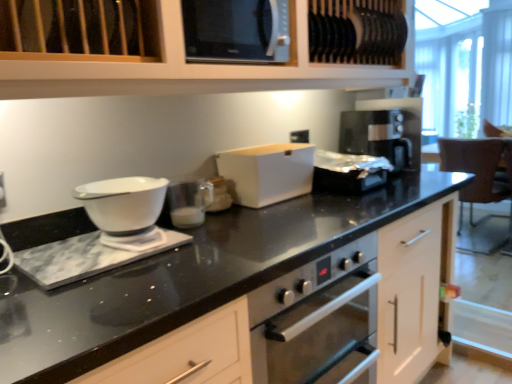
Question: Should I look upward or downward to see satin black coffee machine at right?

Choices:
 (A) down
 (B) up

Answer: (B)

Question: From a real-world perspective, is white matte cabinet at upper center located beneath satin black coffee machine at right?

Choices:
 (A) no
 (B) yes

Answer: (A)

Question: Is white matte cabinet at upper center facing towards satin black coffee machine at right?

Choices:
 (A) no
 (B) yes

Answer: (A)

Question: From the image's perspective, is white matte cabinet at upper center above satin black coffee machine at right?

Choices:
 (A) yes
 (B) no

Answer: (A)

Question: Is white matte cabinet at upper center turned away from satin black coffee machine at right?

Choices:
 (A) yes
 (B) no

Answer: (B)

Question: Does white matte cabinet at upper center have a smaller size compared to satin black coffee machine at right?

Choices:
 (A) yes
 (B) no

Answer: (B)

Question: Considering the relative sizes of white matte cabinet at upper center and satin black coffee machine at right in the image provided, is white matte cabinet at upper center taller than satin black coffee machine at right?

Choices:
 (A) no
 (B) yes

Answer: (B)

Question: Is black glossy microwave at upper center to the right of satin black coffee machine at right from the viewer's perspective?

Choices:
 (A) yes
 (B) no

Answer: (B)

Question: From the image's perspective, is black glossy microwave at upper center located above satin black coffee machine at right?

Choices:
 (A) yes
 (B) no

Answer: (A)

Question: Is black glossy microwave at upper center located outside satin black coffee machine at right?

Choices:
 (A) yes
 (B) no

Answer: (A)

Question: From a real-world perspective, is black glossy microwave at upper center beneath satin black coffee machine at right?

Choices:
 (A) yes
 (B) no

Answer: (B)

Question: Is black glossy microwave at upper center turned away from satin black coffee machine at right?

Choices:
 (A) no
 (B) yes

Answer: (A)

Question: Is black glossy microwave at upper center thinner than satin black coffee machine at right?

Choices:
 (A) yes
 (B) no

Answer: (B)

Question: Is black glossy microwave at upper center positioned with its back to white matte cabinet at upper center?

Choices:
 (A) no
 (B) yes

Answer: (B)